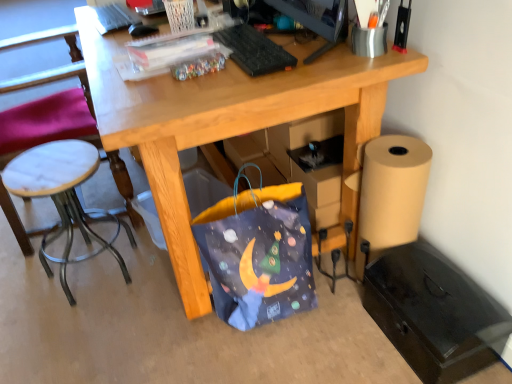
Identify the location of free spot in front of white marble stool at left. (79, 337).